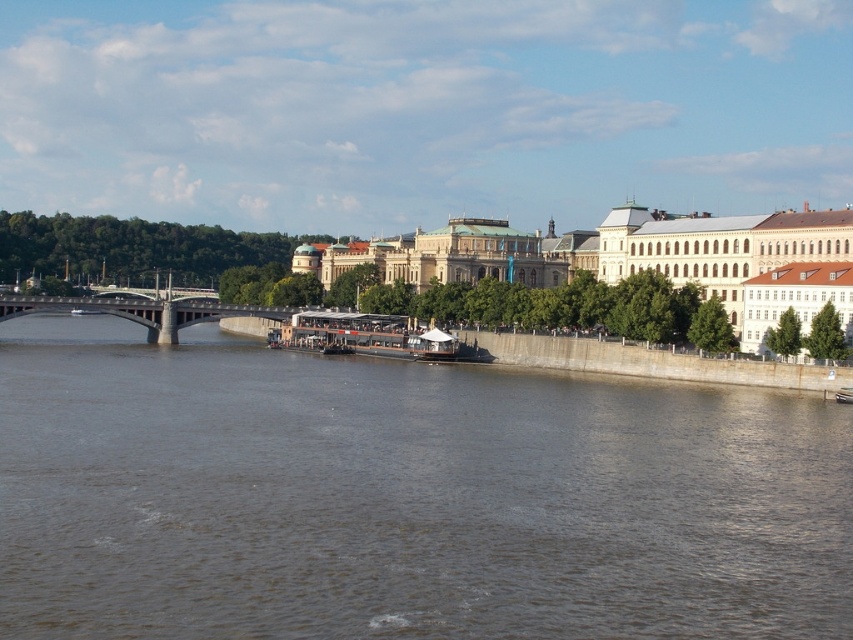
Which is behind, point (201, 456) or point (280, 316)?

The point (280, 316) is behind.

Does brown water at center appear on the left side of concrete bridge at left?

Incorrect, brown water at center is not on the left side of concrete bridge at left.

Identify the location of brown water at center. The height and width of the screenshot is (640, 853). (403, 497).

You are a GUI agent. You are given a task and a screenshot of the screen. Output one action in this format:
    pyautogui.click(x=<x>, y=<y>)
    Task: Click on the brown water at center
    This screenshot has height=640, width=853.
    Given the screenshot: What is the action you would take?
    pyautogui.click(x=403, y=497)

Who is more distant from viewer, (39, 596) or (408, 326)?

Point (408, 326)

Is point (729, 534) positioned in front of point (317, 308)?

Yes, it is in front of point (317, 308).

Where is `brown water at center`? The height and width of the screenshot is (640, 853). brown water at center is located at coordinates (403, 497).

Does wooden polished boat at center appear under concrete bridge at left?

Yes.

Find the location of a particular element. This screenshot has height=640, width=853. wooden polished boat at center is located at coordinates (370, 337).

Identify the location of wooden polished boat at center. The image size is (853, 640). (370, 337).